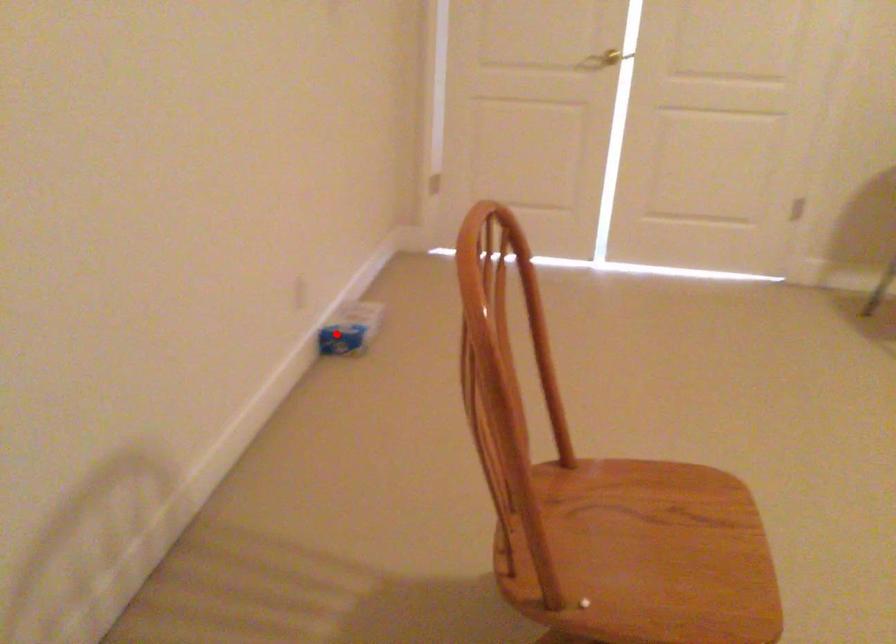
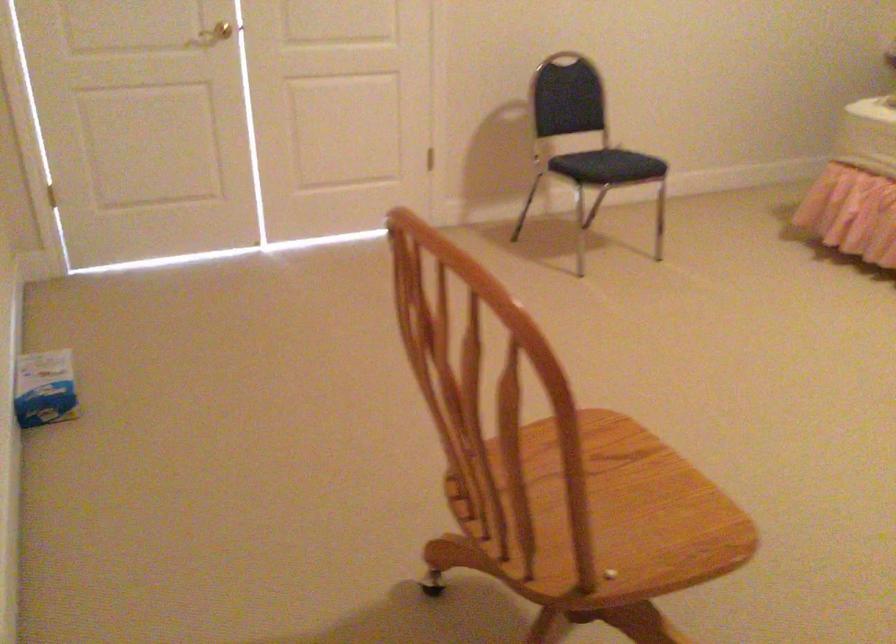
Question: I am providing you with two images of the same scene from different viewpoints. A red point is marked on the first image. At the location where the point appears in image 1, is it still visible in image 2?

Choices:
 (A) Yes
 (B) No

Answer: (A)